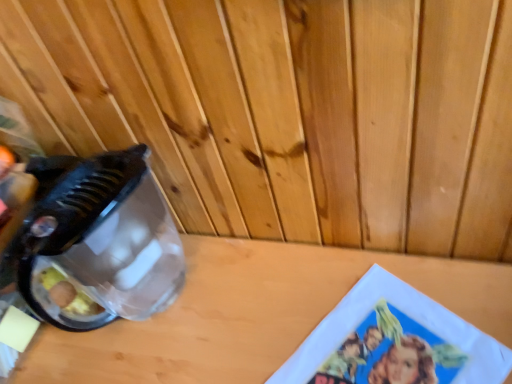
The image size is (512, 384). I want to click on free point above transparent plastic blender at left (from a real-world perspective), so click(x=70, y=195).